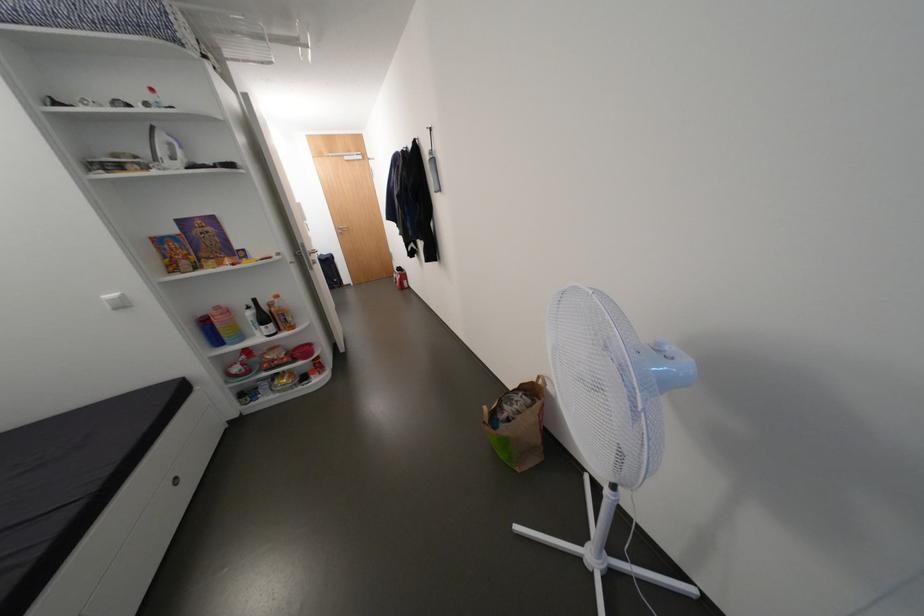
Find where to lift the red plastic bowl. Please return your answer as a coordinate pair (x, y).

(302, 351)